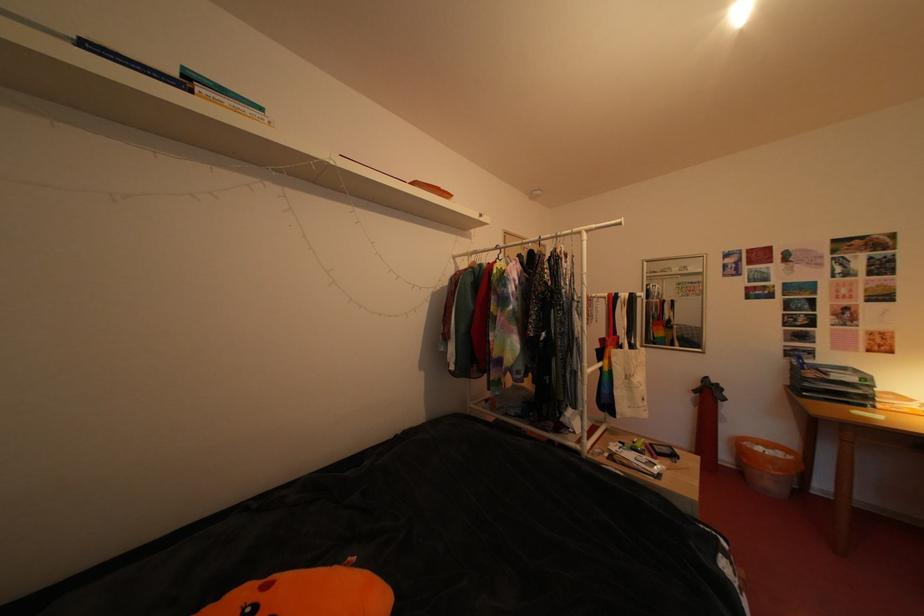
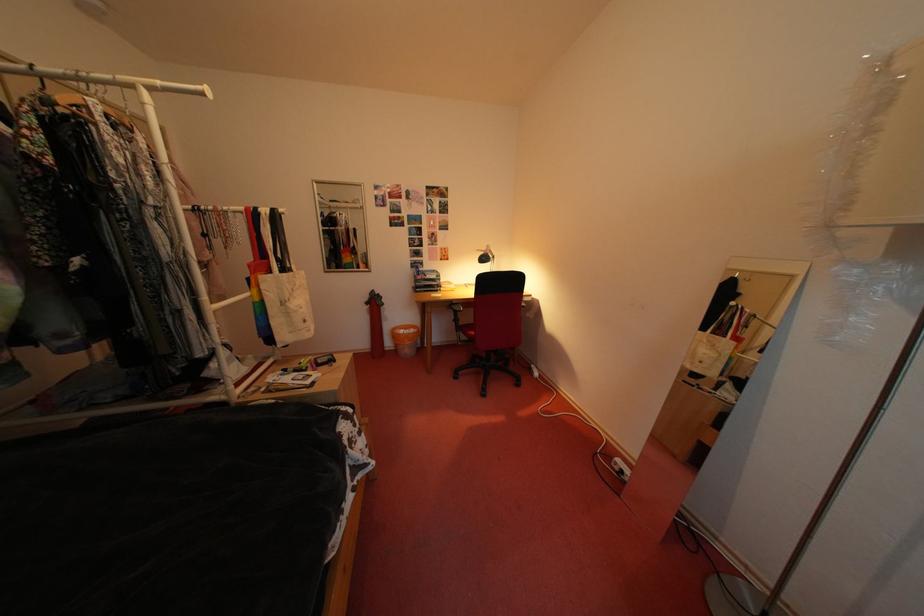
Based on the continuous images, in which direction is the camera rotating?

The camera rotated toward right-down.